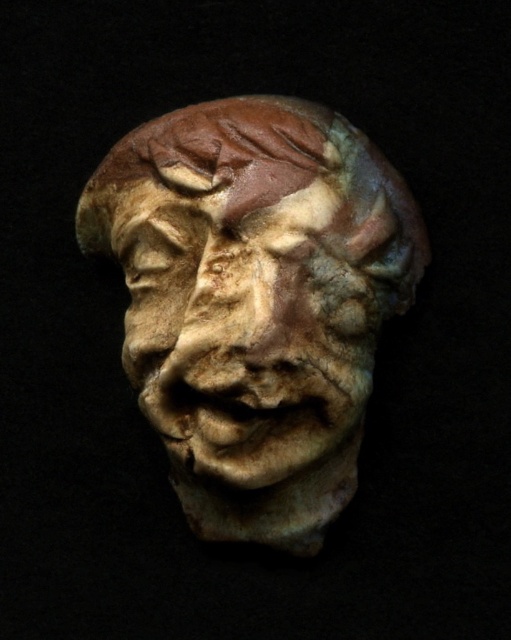
Is matte clay sculpture at center smaller than matte clay face at center?

Actually, matte clay sculpture at center might be larger than matte clay face at center.

Between matte clay sculpture at center and matte clay face at center, which one appears on the right side from the viewer's perspective?

From the viewer's perspective, matte clay sculpture at center appears more on the right side.

Find the location of `matte clay sculpture at center`. matte clay sculpture at center is located at coordinates (256, 301).